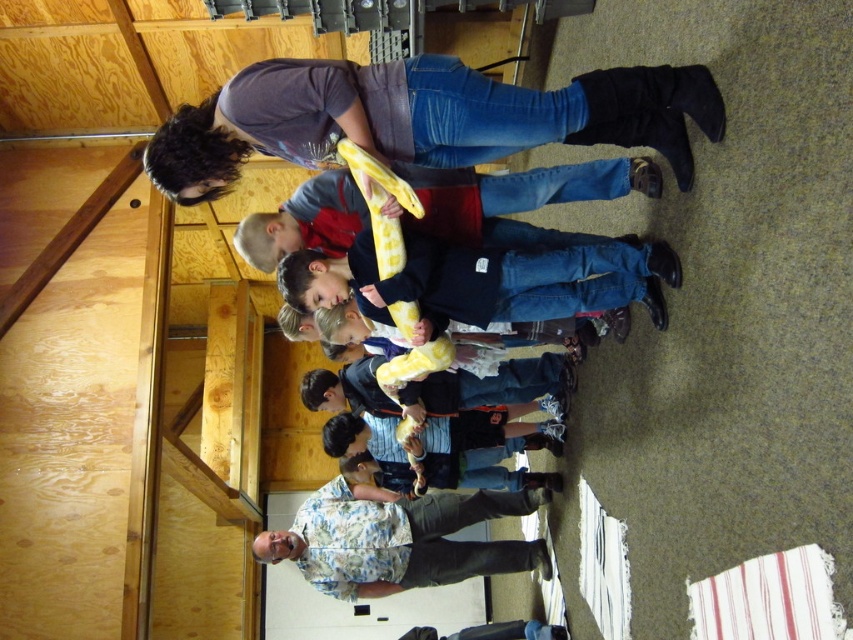
Is matte gray shirt at upper center shorter than jeans at center?

No, matte gray shirt at upper center is not shorter than jeans at center.

Is matte gray shirt at upper center taller than jeans at center?

Yes.

Is point (387, 109) closer to camera compared to point (619, 259)?

Yes, point (387, 109) is in front of point (619, 259).

Where is `matte gray shirt at upper center`? The image size is (853, 640). matte gray shirt at upper center is located at coordinates (422, 116).

Based on the photo, which is more to the right, matte gray shirt at upper center or floral shirt at lower center?

From the viewer's perspective, matte gray shirt at upper center appears more on the right side.

Looking at this image, which of these two, matte gray shirt at upper center or floral shirt at lower center, stands taller?

Standing taller between the two is floral shirt at lower center.

In order to click on matte gray shirt at upper center in this screenshot , I will do `click(422, 116)`.

The image size is (853, 640). What are the coordinates of `matte gray shirt at upper center` in the screenshot? It's located at (422, 116).

Is jeans at center wider than floral shirt at lower center?

No.

Does point (659, 301) come behind point (403, 561)?

That is False.

Who is more distant from viewer, (569, 246) or (360, 529)?

Positioned behind is point (360, 529).

Find the location of a particular element. This screenshot has height=640, width=853. jeans at center is located at coordinates (479, 280).